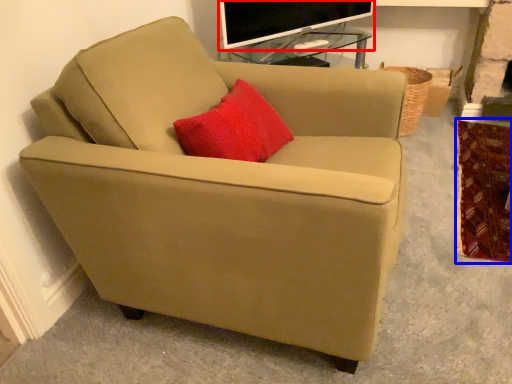
Question: Which point is closer to the camera, television (highlighted by a red box) or blanket (highlighted by a blue box)?

Choices:
 (A) television
 (B) blanket

Answer: (B)